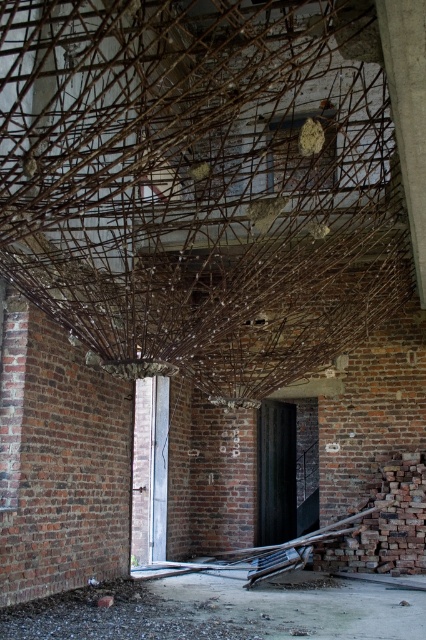
Who is shorter, brown textured branch at center or smooth concrete pillar at upper right?

Standing shorter between the two is brown textured branch at center.

How distant is brown textured branch at center from smooth concrete pillar at upper right?

brown textured branch at center and smooth concrete pillar at upper right are 5.03 meters apart.

At what (x,y) coordinates should I click in order to perform the action: click on brown textured branch at center. Please return your answer as a coordinate pair (x, y). The width and height of the screenshot is (426, 640). Looking at the image, I should click on (201, 182).